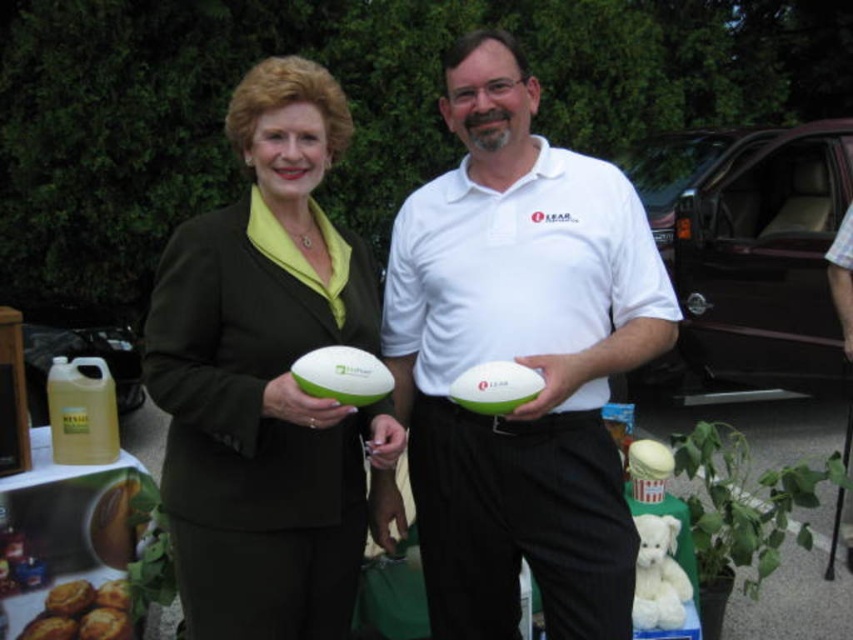
Question: Which of the following is the farthest from the observer?

Choices:
 (A) (241, 211)
 (B) (447, 460)
 (C) (53, 616)

Answer: (C)

Question: Is matte green suit at center bigger than golden brown bread at lower left?

Choices:
 (A) yes
 (B) no

Answer: (A)

Question: Observing the image, what is the correct spatial positioning of golden brown muffin at lower left in reference to golden brown bread at lower left?

Choices:
 (A) left
 (B) right

Answer: (B)

Question: Which point is farther to the camera?

Choices:
 (A) (65, 602)
 (B) (636, 212)
 (C) (125, 595)
 (D) (396, 428)

Answer: (C)

Question: Among these objects, which one is nearest to the camera?

Choices:
 (A) golden brown muffin at lower left
 (B) golden brown bread at lower left

Answer: (A)

Question: Can you confirm if white matte polo shirt at center is thinner than golden brown bread at lower left?

Choices:
 (A) yes
 (B) no

Answer: (B)